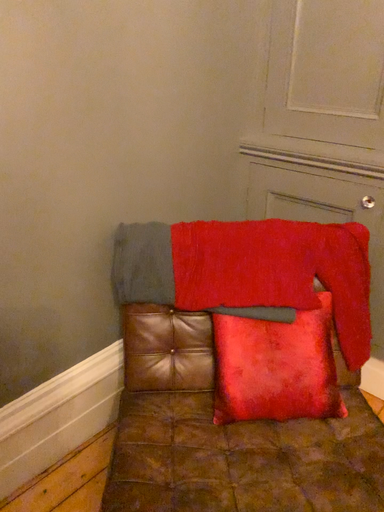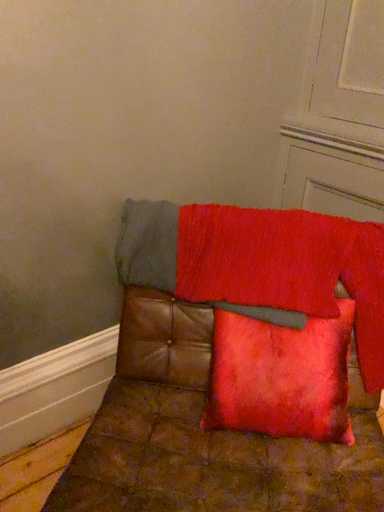
Question: How did the camera likely rotate when shooting the video?

Choices:
 (A) rotated right
 (B) rotated left

Answer: (B)